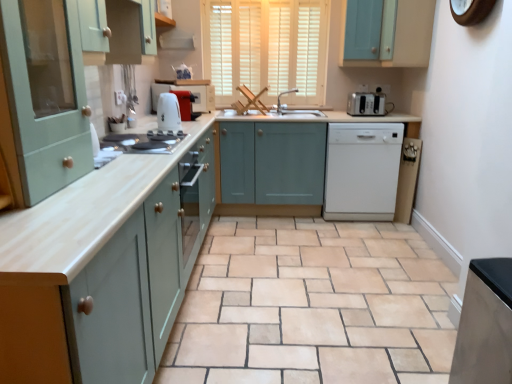
The height and width of the screenshot is (384, 512). In order to click on blank space above beige ceramic tile at center (from a real-world perspective) in this screenshot , I will do `click(333, 261)`.